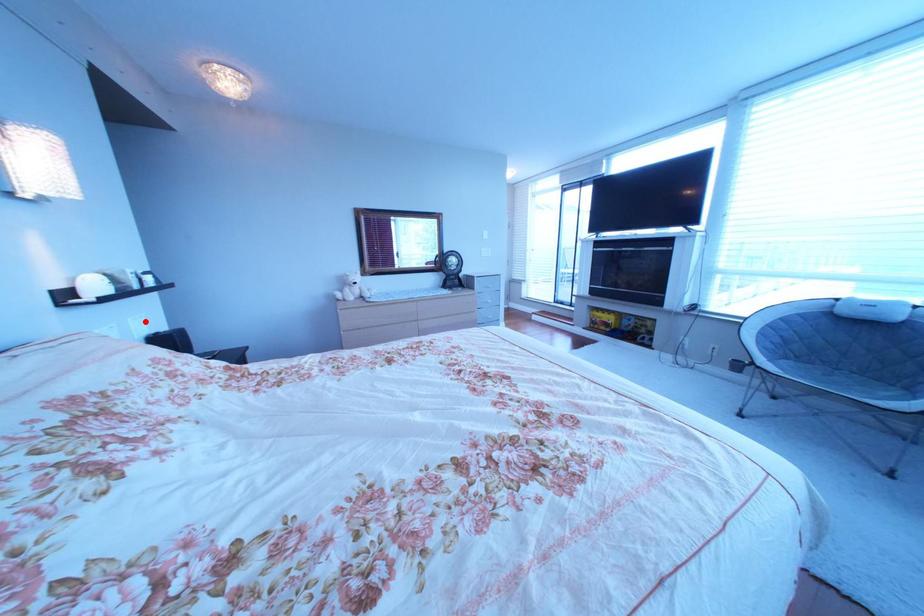
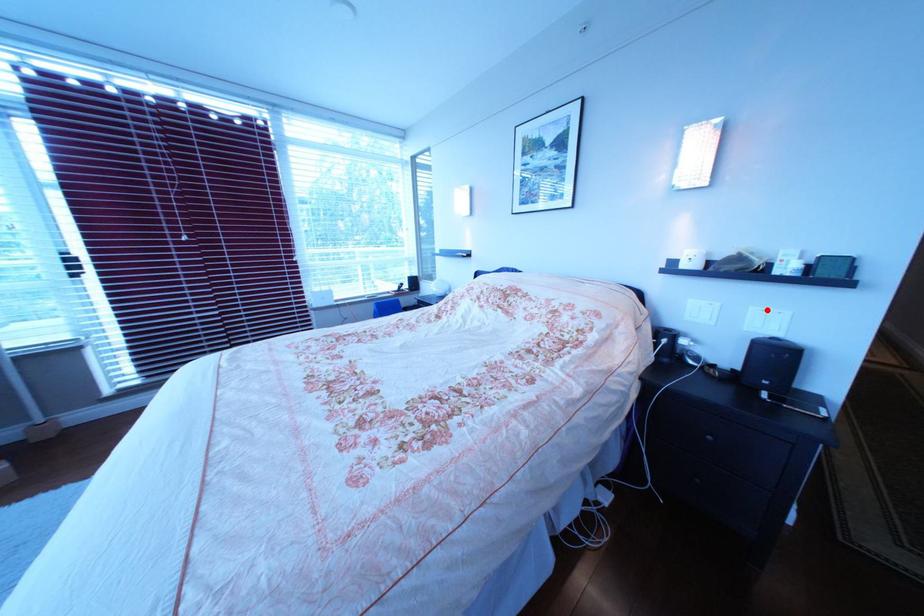
I am providing you with two images of the same scene from different viewpoints. A red point is marked on the first image and another point is marked on the second image. Are the points marked in image1 and image2 representing the same 3D position?

Yes